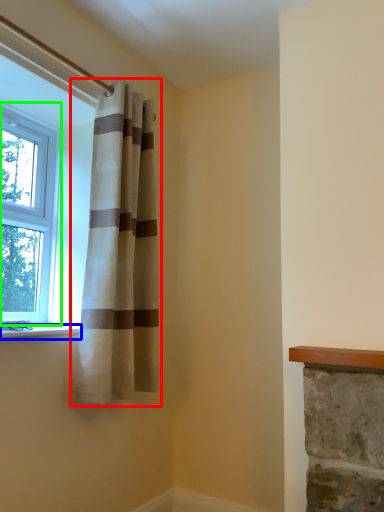
Question: Estimate the real-world distances between objects in this image. Which object is closer to curtain (highlighted by a red box), window sill (highlighted by a blue box) or window (highlighted by a green box)?

Choices:
 (A) window sill
 (B) window

Answer: (B)